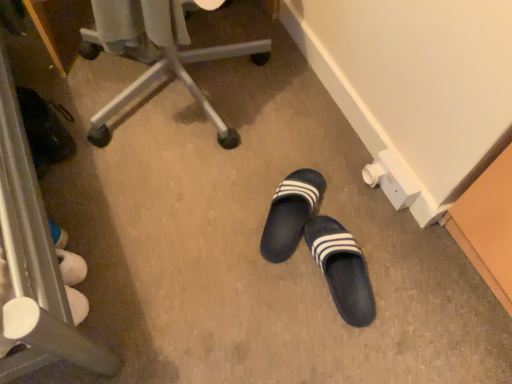
Image resolution: width=512 pixels, height=384 pixels. Describe the element at coordinates (341, 269) in the screenshot. I see `black rubber slippers at center, the 2th footwear positioned from the left` at that location.

Describe the element at coordinates (290, 213) in the screenshot. This screenshot has width=512, height=384. I see `black rubber slippers at center, the 1th footwear when ordered from left to right` at that location.

This screenshot has width=512, height=384. I want to click on black rubber slippers at center, the second footwear in the right-to-left sequence, so click(x=290, y=213).

Locate an element on the screen. This screenshot has height=384, width=512. black rubber slippers at center, the 2th footwear positioned from the left is located at coordinates (341, 269).

In terms of height, does black rubber slippers at center, the 1th footwear when ordered from left to right, look taller or shorter compared to black rubber slippers at center, the 2th footwear positioned from the left?

Considering their sizes, black rubber slippers at center, the 1th footwear when ordered from left to right, has less height than black rubber slippers at center, the 2th footwear positioned from the left.

Between black rubber slippers at center, the second footwear in the right-to-left sequence, and black rubber slippers at center, the 2th footwear positioned from the left, which one has smaller width?

black rubber slippers at center, the 2th footwear positioned from the left.

Would you consider black rubber slippers at center, the second footwear in the right-to-left sequence, to be distant from matte plastic chair at upper center?

No, there isn't a large distance between black rubber slippers at center, the second footwear in the right-to-left sequence, and matte plastic chair at upper center.

From a real-world perspective, is black rubber slippers at center, the 1th footwear when ordered from left to right, positioned above or below matte plastic chair at upper center?

black rubber slippers at center, the 1th footwear when ordered from left to right, is situated lower than matte plastic chair at upper center in the real world.

Would you say black rubber slippers at center, the second footwear in the right-to-left sequence, is to the left or to the right of matte plastic chair at upper center in the picture?

black rubber slippers at center, the second footwear in the right-to-left sequence, is positioned on matte plastic chair at upper center's right side.

Based on the photo, from the image's perspective, does black rubber slippers at center, the 1th footwear when ordered from left to right, appear higher than matte plastic chair at upper center?

No.

Is matte plastic chair at upper center next to black rubber slippers at center, the 2th footwear positioned from the left?

No, matte plastic chair at upper center is not in contact with black rubber slippers at center, the 2th footwear positioned from the left.

Starting from the matte plastic chair at upper center, which footwear is the 1st one behind? Please provide its 2D coordinates.

[(341, 269)]

Looking at this image, considering their positions, is matte plastic chair at upper center located in front of or behind black rubber slippers at center, the 1th footwear when ordered from right to left?

matte plastic chair at upper center is in front of black rubber slippers at center, the 1th footwear when ordered from right to left.

Is point (173, 5) closer to camera compared to point (313, 226)?

Yes, it is in front of point (313, 226).

Between matte plastic chair at upper center and black rubber slippers at center, the second footwear in the right-to-left sequence, which one has more height?

matte plastic chair at upper center is taller.

Considering the relative sizes of matte plastic chair at upper center and black rubber slippers at center, the 1th footwear when ordered from left to right, in the image provided, is matte plastic chair at upper center thinner than black rubber slippers at center, the 1th footwear when ordered from left to right,?

In fact, matte plastic chair at upper center might be wider than black rubber slippers at center, the 1th footwear when ordered from left to right.

Is point (178, 39) more distant than point (263, 238)?

No, it is in front of (263, 238).

Is matte plastic chair at upper center facing away from black rubber slippers at center, the second footwear in the right-to-left sequence?

No, matte plastic chair at upper center is not facing the opposite direction of black rubber slippers at center, the second footwear in the right-to-left sequence.

Is black rubber slippers at center, the 2th footwear positioned from the left, bigger than black rubber slippers at center, the second footwear in the right-to-left sequence?

Actually, black rubber slippers at center, the 2th footwear positioned from the left, might be smaller than black rubber slippers at center, the second footwear in the right-to-left sequence.

Consider the image. Is black rubber slippers at center, the 2th footwear positioned from the left, spatially inside black rubber slippers at center, the 1th footwear when ordered from left to right, or outside of it?

black rubber slippers at center, the 2th footwear positioned from the left, cannot be found inside black rubber slippers at center, the 1th footwear when ordered from left to right.

Image resolution: width=512 pixels, height=384 pixels. Identify the location of footwear that appears above the black rubber slippers at center, the 2th footwear positioned from the left (from a real-world perspective). (290, 213).

Is black rubber slippers at center, the 2th footwear positioned from the left, touching black rubber slippers at center, the 1th footwear when ordered from left to right?

No, black rubber slippers at center, the 2th footwear positioned from the left, is not touching black rubber slippers at center, the 1th footwear when ordered from left to right.

Is black rubber slippers at center, the 1th footwear when ordered from right to left, oriented towards matte plastic chair at upper center?

No.

From a real-world perspective, which is physically above, black rubber slippers at center, the 2th footwear positioned from the left, or matte plastic chair at upper center?

matte plastic chair at upper center, from a real-world perspective.

Identify the location of footwear that is the 2nd one below the matte plastic chair at upper center (from a real-world perspective). This screenshot has height=384, width=512. (341, 269).

Is black rubber slippers at center, the 2th footwear positioned from the left, to the left or to the right of matte plastic chair at upper center in the image?

black rubber slippers at center, the 2th footwear positioned from the left, is positioned on matte plastic chair at upper center's right side.

Identify the location of footwear in front of the black rubber slippers at center, the 1th footwear when ordered from left to right. The image size is (512, 384). (341, 269).

The width and height of the screenshot is (512, 384). I want to click on footwear that is the 2nd one when counting backward from the matte plastic chair at upper center, so click(x=290, y=213).

From the image, which object appears to be farther from black rubber slippers at center, the second footwear in the right-to-left sequence, matte plastic chair at upper center or black rubber slippers at center, the 2th footwear positioned from the left?

matte plastic chair at upper center is positioned further to the anchor black rubber slippers at center, the second footwear in the right-to-left sequence.

Looking at the image, which one is located further to black rubber slippers at center, the 1th footwear when ordered from left to right, black rubber slippers at center, the 1th footwear when ordered from right to left, or matte plastic chair at upper center?

matte plastic chair at upper center lies further to black rubber slippers at center, the 1th footwear when ordered from left to right, than the other object.

From the image, which object appears to be farther from matte plastic chair at upper center, black rubber slippers at center, the 1th footwear when ordered from left to right, or black rubber slippers at center, the 1th footwear when ordered from right to left?

black rubber slippers at center, the 1th footwear when ordered from right to left, lies further to matte plastic chair at upper center than the other object.

Estimate the real-world distances between objects in this image. Which object is closer to black rubber slippers at center, the 2th footwear positioned from the left, matte plastic chair at upper center or black rubber slippers at center, the second footwear in the right-to-left sequence?

black rubber slippers at center, the second footwear in the right-to-left sequence.

Looking at the image, which one is located closer to black rubber slippers at center, the 2th footwear positioned from the left, black rubber slippers at center, the second footwear in the right-to-left sequence, or matte plastic chair at upper center?

The object closer to black rubber slippers at center, the 2th footwear positioned from the left, is black rubber slippers at center, the second footwear in the right-to-left sequence.

Based on their spatial positions, is black rubber slippers at center, the 1th footwear when ordered from right to left, or black rubber slippers at center, the 1th footwear when ordered from left to right, closer to matte plastic chair at upper center?

The object closer to matte plastic chair at upper center is black rubber slippers at center, the 1th footwear when ordered from left to right.

Locate an element on the screen. footwear between matte plastic chair at upper center and black rubber slippers at center, the 1th footwear when ordered from right to left, from top to bottom is located at coordinates (290, 213).